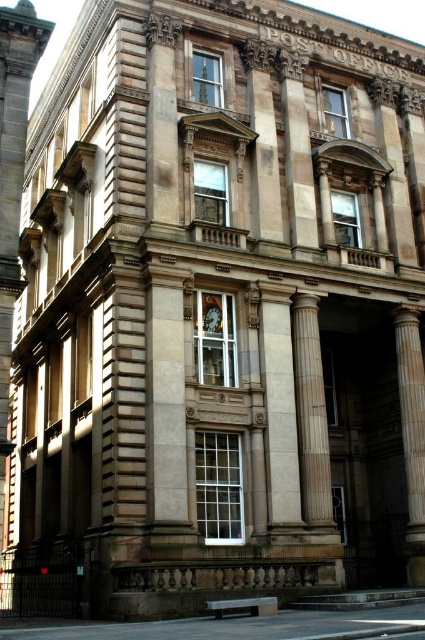
Which is below, white marble pillar at center or white marble column at center?

Positioned lower is white marble column at center.

Does point (282, 410) come closer to viewer compared to point (419, 492)?

Yes, it is.

At what (x,y) coordinates should I click in order to perform the action: click on white marble pillar at center. Please return your answer as a coordinate pair (x, y). This screenshot has height=640, width=425. Looking at the image, I should click on 278,404.

Is smooth stone column at center wider than white marble column at center?

Correct, the width of smooth stone column at center exceeds that of white marble column at center.

Between smooth stone column at center and white marble column at center, which one appears on the left side from the viewer's perspective?

smooth stone column at center

Is point (331, 518) more distant than point (414, 378)?

No, it is in front of (414, 378).

Locate an element on the screen. This screenshot has height=640, width=425. smooth stone column at center is located at coordinates (311, 413).

Is white marble column at center positioned at the back of matte glass clock at center?

Yes, white marble column at center is further from the viewer.

At what (x,y) coordinates should I click in order to perform the action: click on white marble column at center. Please return your answer as a coordinate pair (x, y). Looking at the image, I should click on (411, 435).

From the picture: Who is more forward, (x=416, y=486) or (x=212, y=324)?

Positioned in front is point (x=212, y=324).

Find the location of a particular element. white marble column at center is located at coordinates (411, 435).